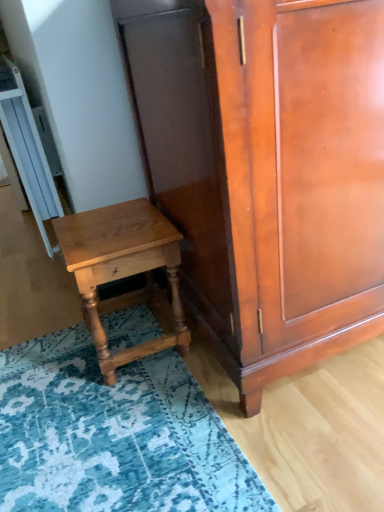
Question: From a real-world perspective, is shiny brown cabinet at center located beneath light brown wood nightstand at lower left?

Choices:
 (A) yes
 (B) no

Answer: (B)

Question: From the image's perspective, is shiny brown cabinet at center over light brown wood nightstand at lower left?

Choices:
 (A) yes
 (B) no

Answer: (A)

Question: Is shiny brown cabinet at center thinner than light brown wood nightstand at lower left?

Choices:
 (A) no
 (B) yes

Answer: (A)

Question: From a real-world perspective, is shiny brown cabinet at center physically above light brown wood nightstand at lower left?

Choices:
 (A) no
 (B) yes

Answer: (B)

Question: Is shiny brown cabinet at center in front of light brown wood nightstand at lower left?

Choices:
 (A) no
 (B) yes

Answer: (B)

Question: Considering the positions of blue textured rug at lower left and shiny brown cabinet at center in the image, is blue textured rug at lower left bigger or smaller than shiny brown cabinet at center?

Choices:
 (A) big
 (B) small

Answer: (B)

Question: From a real-world perspective, is blue textured rug at lower left positioned above or below shiny brown cabinet at center?

Choices:
 (A) below
 (B) above

Answer: (A)

Question: Relative to shiny brown cabinet at center, is blue textured rug at lower left in front or behind?

Choices:
 (A) behind
 (B) front

Answer: (A)

Question: Is blue textured rug at lower left inside the boundaries of shiny brown cabinet at center, or outside?

Choices:
 (A) inside
 (B) outside

Answer: (B)

Question: In terms of size, does light brown wood nightstand at lower left appear bigger or smaller than shiny brown cabinet at center?

Choices:
 (A) small
 (B) big

Answer: (A)

Question: From a real-world perspective, relative to shiny brown cabinet at center, is light brown wood nightstand at lower left vertically above or below?

Choices:
 (A) above
 (B) below

Answer: (B)

Question: Does point (142, 354) appear closer or farther from the camera than point (264, 198)?

Choices:
 (A) farther
 (B) closer

Answer: (A)

Question: Considering the positions of light brown wood nightstand at lower left and shiny brown cabinet at center in the image, is light brown wood nightstand at lower left taller or shorter than shiny brown cabinet at center?

Choices:
 (A) tall
 (B) short

Answer: (B)

Question: Is shiny brown cabinet at center to the left or to the right of blue textured rug at lower left in the image?

Choices:
 (A) right
 (B) left

Answer: (A)

Question: From the image's perspective, relative to blue textured rug at lower left, is shiny brown cabinet at center above or below?

Choices:
 (A) below
 (B) above

Answer: (B)